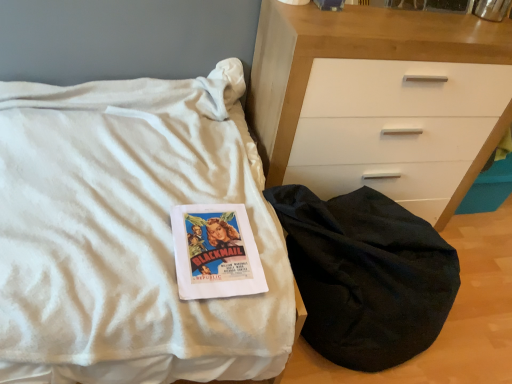
Question: Does white matte chest of drawers at center have a lesser height compared to white soft blanket at center?

Choices:
 (A) no
 (B) yes

Answer: (A)

Question: Considering the relative sizes of white matte chest of drawers at center and white soft blanket at center in the image provided, is white matte chest of drawers at center smaller than white soft blanket at center?

Choices:
 (A) yes
 (B) no

Answer: (A)

Question: Could you tell me if white matte chest of drawers at center is turned towards white soft blanket at center?

Choices:
 (A) yes
 (B) no

Answer: (B)

Question: Does white matte chest of drawers at center have a greater height compared to white soft blanket at center?

Choices:
 (A) yes
 (B) no

Answer: (A)

Question: Is white matte chest of drawers at center further to the viewer compared to white soft blanket at center?

Choices:
 (A) no
 (B) yes

Answer: (B)

Question: Does white matte chest of drawers at center have a larger size compared to white soft blanket at center?

Choices:
 (A) no
 (B) yes

Answer: (A)

Question: Does white soft blanket at center have a smaller size compared to black fabric sleeping bag at lower right?

Choices:
 (A) no
 (B) yes

Answer: (A)

Question: Is white soft blanket at center facing towards black fabric sleeping bag at lower right?

Choices:
 (A) yes
 (B) no

Answer: (A)

Question: Is black fabric sleeping bag at lower right inside white soft blanket at center?

Choices:
 (A) yes
 (B) no

Answer: (B)

Question: Can you confirm if white soft blanket at center is positioned to the left of black fabric sleeping bag at lower right?

Choices:
 (A) yes
 (B) no

Answer: (A)

Question: Does white soft blanket at center lie behind black fabric sleeping bag at lower right?

Choices:
 (A) yes
 (B) no

Answer: (B)

Question: Is white soft blanket at center far away from black fabric sleeping bag at lower right?

Choices:
 (A) yes
 (B) no

Answer: (B)

Question: Does black fabric sleeping bag at lower right have a lesser height compared to white matte chest of drawers at center?

Choices:
 (A) yes
 (B) no

Answer: (A)